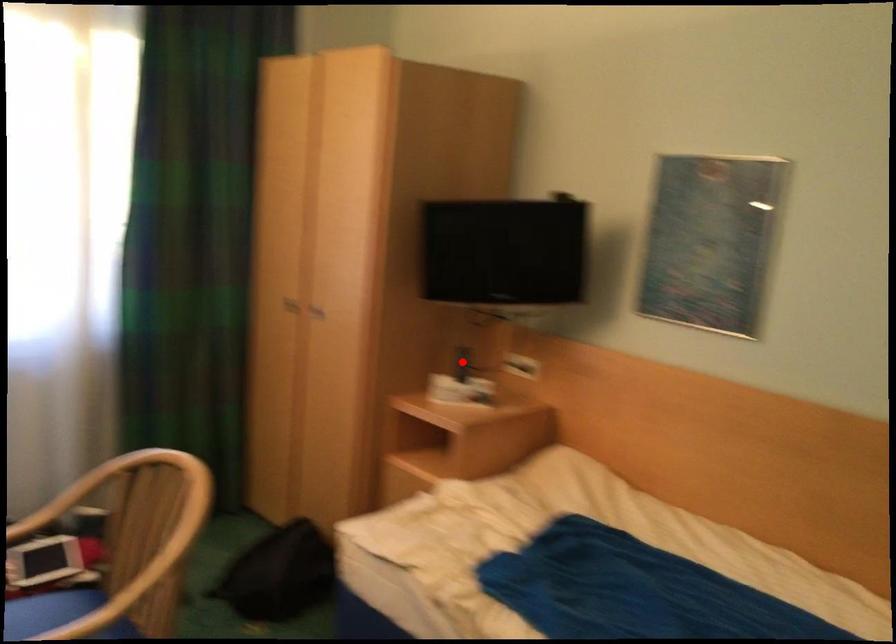
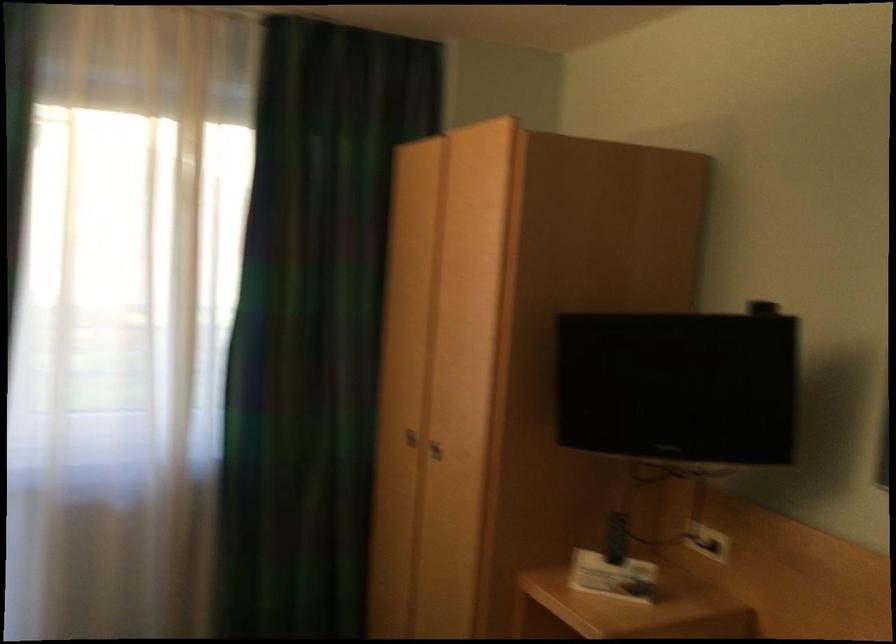
Question: I am providing you with two images of the same scene from different viewpoints. Given a red point in image1, look at the same physical point in image2. Is it:

Choices:
 (A) Closer to the viewpoint
 (B) Farther from the viewpoint

Answer: (A)